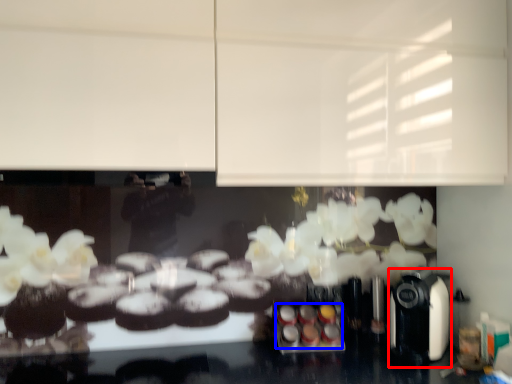
Question: Which object appears closest to the camera in this image, coffee machine (highlighted by a red box) or food (highlighted by a blue box)?

Choices:
 (A) coffee machine
 (B) food

Answer: (A)